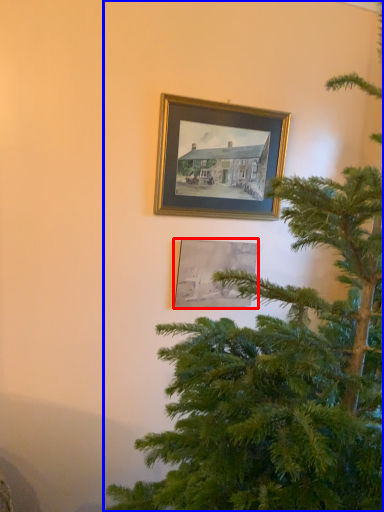
Question: Which of the following is the closest to the observer, picture frame (highlighted by a red box) or christmas tree (highlighted by a blue box)?

Choices:
 (A) picture frame
 (B) christmas tree

Answer: (B)